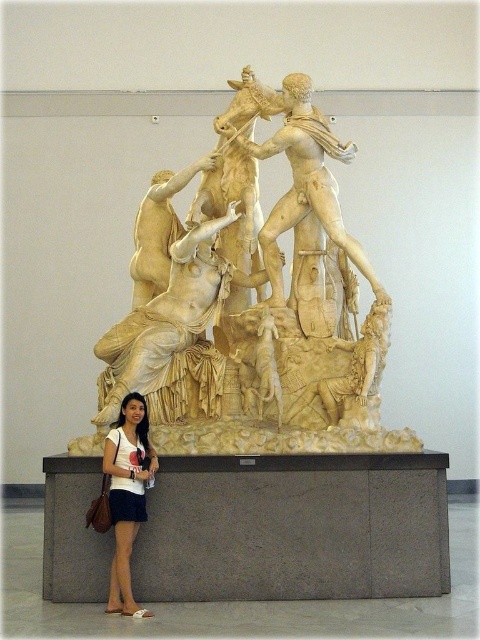
Question: Does white marble sculpture at center appear on the left side of gray concrete base at lower center?

Choices:
 (A) yes
 (B) no

Answer: (B)

Question: Can you confirm if white marble sculpture at center is positioned to the left of gray concrete base at lower center?

Choices:
 (A) yes
 (B) no

Answer: (B)

Question: Does white marble sculpture at center appear under gray concrete base at lower center?

Choices:
 (A) no
 (B) yes

Answer: (A)

Question: Estimate the real-world distances between objects in this image. Which object is closer to the gray concrete base at lower center?

Choices:
 (A) white marble sculpture at center
 (B) matte white dress at lower left

Answer: (B)

Question: Which of the following is the farthest from the observer?

Choices:
 (A) matte white dress at lower left
 (B) white marble sculpture at center
 (C) gray concrete base at lower center

Answer: (B)

Question: Which point is closer to the camera taking this photo?

Choices:
 (A) pos(236,289)
 (B) pos(325,502)
 (C) pos(121,420)

Answer: (B)